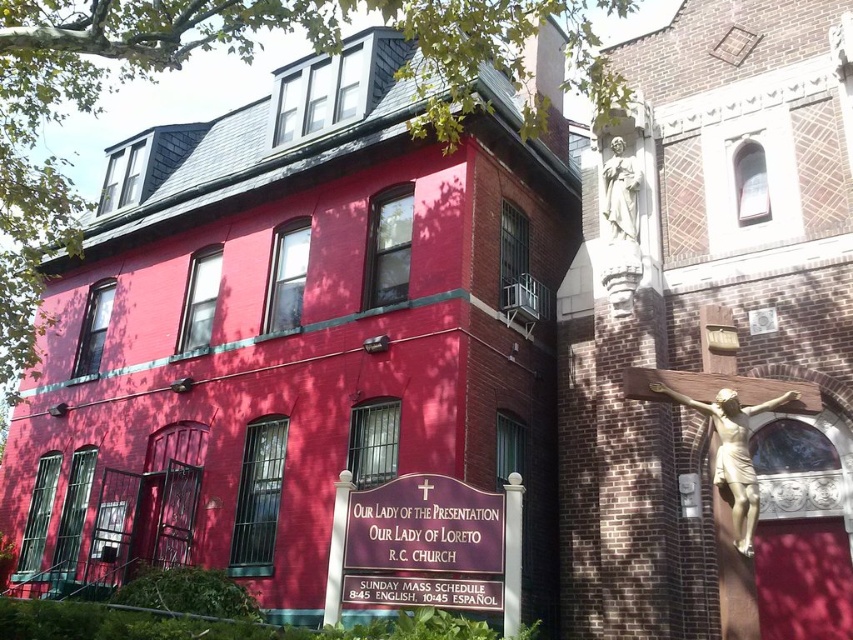
Measure the distance between gold statue of jesus at center and camera.

gold statue of jesus at center and camera are 20.06 feet apart from each other.

Is point (602, 154) closer to viewer compared to point (425, 481)?

No, (602, 154) is further to viewer.

The width and height of the screenshot is (853, 640). Identify the location of gold statue of jesus at center. (715, 333).

Is gold metallic crucifix at right wider than metallic gold cross at center?

Yes.

Who is positioned more to the right, gold metallic crucifix at right or metallic gold cross at center?

gold metallic crucifix at right is more to the right.

What do you see at coordinates (733, 452) in the screenshot?
I see `gold metallic crucifix at right` at bounding box center [733, 452].

The width and height of the screenshot is (853, 640). I want to click on gold metallic crucifix at right, so click(733, 452).

Based on the photo, measure the distance between point (289, 400) and camera.

A distance of 36.09 feet exists between point (289, 400) and camera.

Identify the location of smooth brick chapel at center. (312, 317).

Where is `smooth brick chapel at center`? The height and width of the screenshot is (640, 853). smooth brick chapel at center is located at coordinates (312, 317).